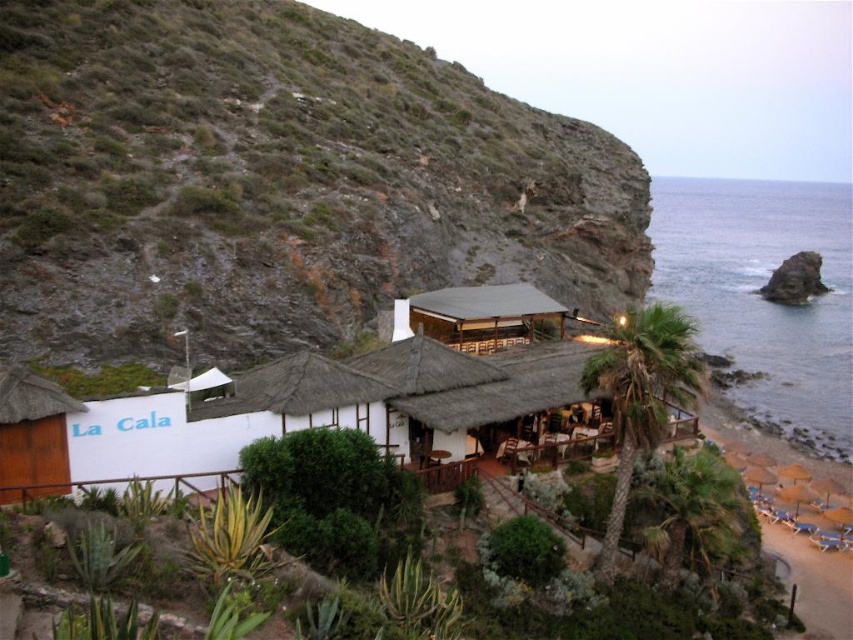
Who is more distant from viewer, (212, 93) or (788, 186)?

The point (788, 186) is more distant.

Based on the photo, between rocky cliff at upper left and blue water at right, which one has more height?

blue water at right is taller.

Identify the location of rocky cliff at upper left. (276, 180).

Does white thatched roof at center appear on the right side of wooden thatched hut at center?

In fact, white thatched roof at center is to the left of wooden thatched hut at center.

Where is `white thatched roof at center`? white thatched roof at center is located at coordinates (306, 403).

Locate an element on the screen. This screenshot has height=640, width=853. white thatched roof at center is located at coordinates (306, 403).

Where is `white thatched roof at center`? The image size is (853, 640). white thatched roof at center is located at coordinates (306, 403).

Is white thatched roof at center below blue water at right?

Yes.

Consider the image. Does white thatched roof at center have a lesser height compared to blue water at right?

Correct, white thatched roof at center is not as tall as blue water at right.

Is point (379, 360) positioned behind point (834, 276)?

No, (379, 360) is in front of (834, 276).

Image resolution: width=853 pixels, height=640 pixels. Find the location of `white thatched roof at center`. white thatched roof at center is located at coordinates (306, 403).